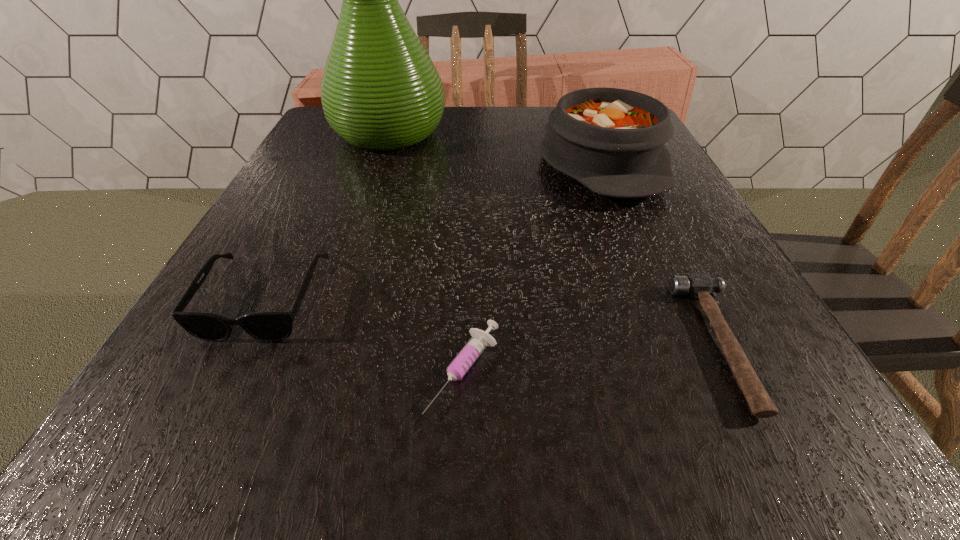
You are a GUI agent. You are given a task and a screenshot of the screen. Output one action in this format:
    pyautogui.click(x=<x>, y=<y>)
    Task: Click on the free location that satisfies the following two spatial constraints: 1. at the front lenses of the third object from right to left; 2. on the right side of the sunglasses
    
    Given the screenshot: What is the action you would take?
    pyautogui.click(x=229, y=370)

Locate an element on the screen. vacant space that satisfies the following two spatial constraints: 1. on the back side of the syringe; 2. on the left side of the second tallest object is located at coordinates (470, 163).

Identify the location of vacant space that satisfies the following two spatial constraints: 1. at the front lenses of the third object from left to right; 2. on the right side of the sunglasses. The width and height of the screenshot is (960, 540). (229, 370).

Identify the location of free space that satisfies the following two spatial constraints: 1. at the front lenses of the third object from right to left; 2. on the right side of the third tallest object. [x=229, y=370].